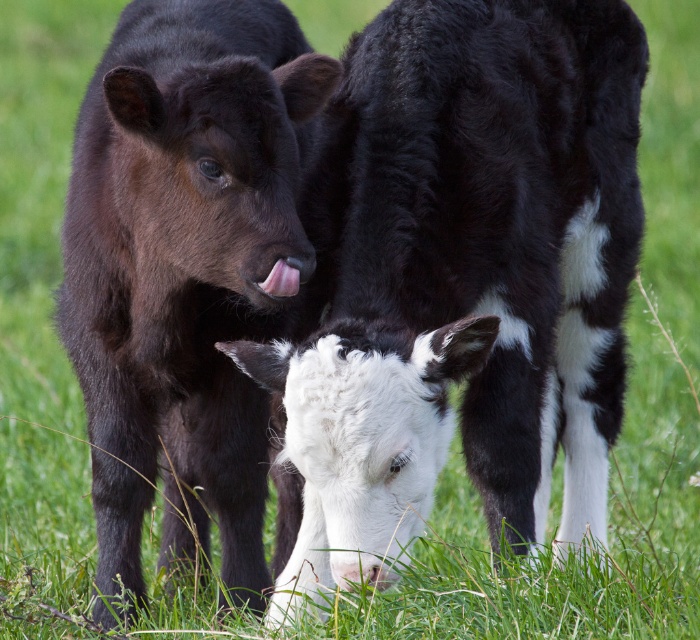
Is point (85, 340) positioned after point (279, 296)?

Yes.

In order to click on black matte calf at left in this screenshot , I will do `click(183, 269)`.